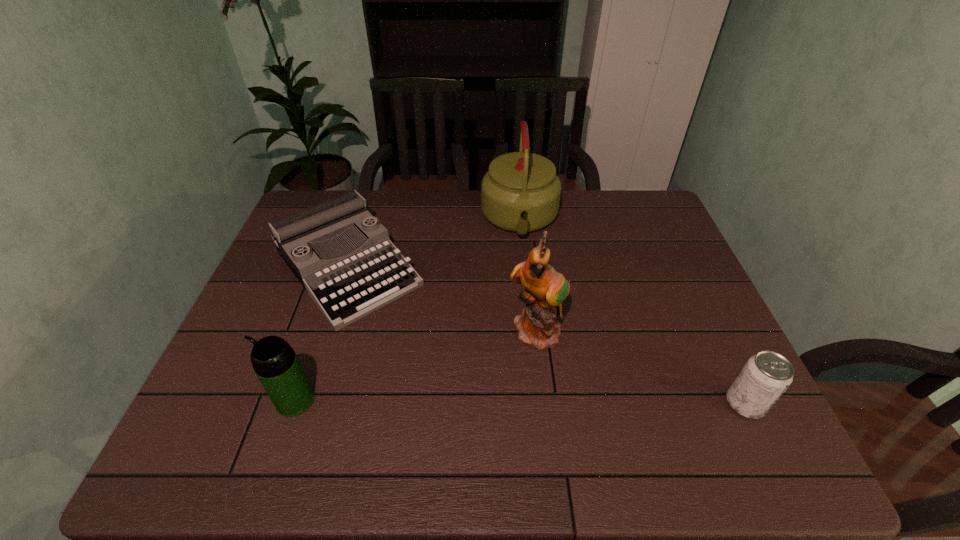
Locate an element on the screen. The width and height of the screenshot is (960, 540). vacant space situated on the typing side of the typewriter is located at coordinates (451, 389).

Locate an element on the screen. This screenshot has width=960, height=540. vacant space situated 0.290m at the spout of the kettle is located at coordinates (527, 328).

Find the location of a particular element. The height and width of the screenshot is (540, 960). vacant area located at the spout of the kettle is located at coordinates (525, 296).

Locate an element on the screen. The width and height of the screenshot is (960, 540). vacant space located at the spout of the kettle is located at coordinates (523, 269).

What are the coordinates of `typewriter that is at the far edge` in the screenshot? It's located at (346, 285).

Where is `kettle that is at the far edge`? This screenshot has height=540, width=960. kettle that is at the far edge is located at coordinates (521, 192).

Identify the location of thermos bottle located at the near edge. The image size is (960, 540). (274, 361).

Find the location of a particular element. soda can located in the near edge section of the desktop is located at coordinates (766, 375).

I want to click on thermos bottle located at the left edge, so click(274, 361).

Locate an element on the screen. typewriter that is at the left edge is located at coordinates (346, 285).